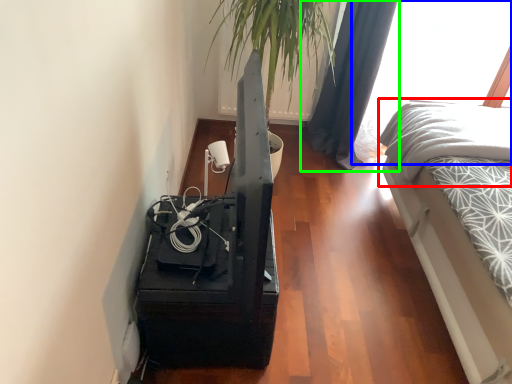
Question: Estimate the real-world distances between objects in this image. Which object is farther from bedding (highlighted by a red box), window (highlighted by a blue box) or curtain (highlighted by a green box)?

Choices:
 (A) window
 (B) curtain

Answer: (A)